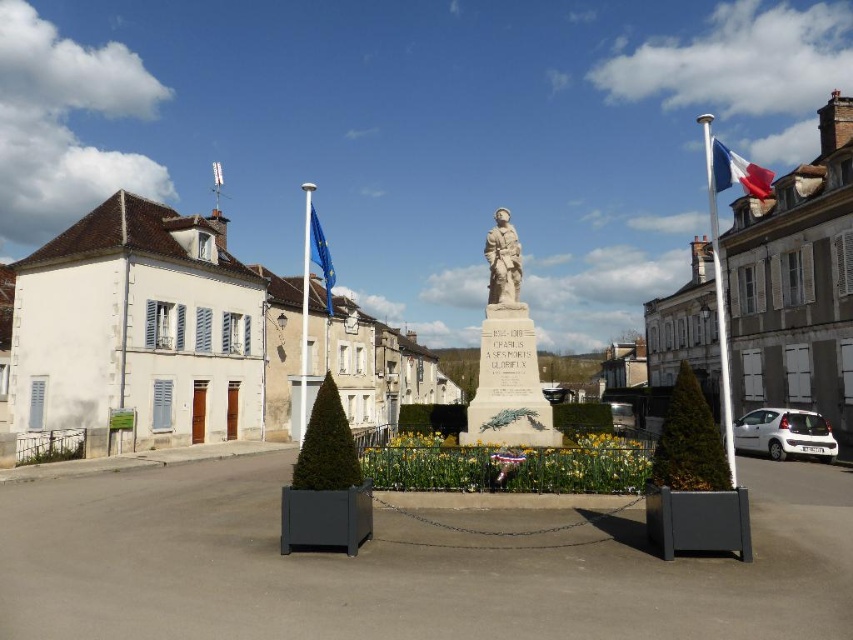
Does blue fabric flag at upper right have a lesser width compared to european union flag at center?

No.

Who is lower down, blue fabric flag at upper right or european union flag at center?

european union flag at center is lower down.

Image resolution: width=853 pixels, height=640 pixels. What are the coordinates of `blue fabric flag at upper right` in the screenshot? It's located at (737, 172).

Which is more to the left, white stone building at center or white stone soldier at center?

Positioned to the left is white stone building at center.

Is point (335, 342) in front of point (519, 257)?

No, (335, 342) is behind (519, 257).

Looking at this image, who is more forward, (189, 266) or (514, 291)?

Point (514, 291) is more forward.

You are a GUI agent. You are given a task and a screenshot of the screen. Output one action in this format:
    pyautogui.click(x=<x>, y=<y>)
    Task: Click on the white stone building at center
    This screenshot has width=853, height=640.
    Given the screenshot: What is the action you would take?
    pyautogui.click(x=189, y=339)

Which is behind, point (210, 346) or point (325, 272)?

The point (210, 346) is behind.

Is the position of white stone building at center less distant than that of european union flag at center?

That is False.

What do you see at coordinates (189, 339) in the screenshot?
I see `white stone building at center` at bounding box center [189, 339].

Identify the location of white stone building at center. This screenshot has height=640, width=853. (189, 339).